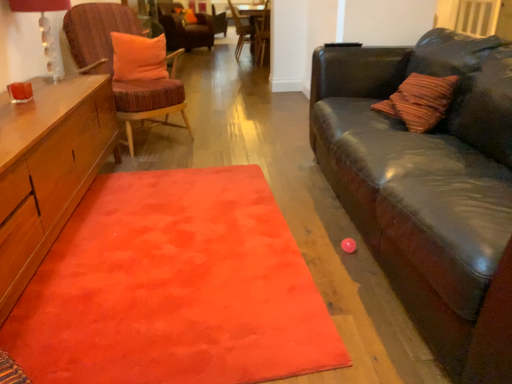
Question: Can you confirm if woven wood chair with orange cushion at left, arranged as the 4th chair when viewed from the back, is wider than matte glass lampshade at upper left?

Choices:
 (A) yes
 (B) no

Answer: (A)

Question: Are woven wood chair with orange cushion at left, arranged as the 4th chair when viewed from the back, and matte glass lampshade at upper left far apart?

Choices:
 (A) yes
 (B) no

Answer: (B)

Question: From the image's perspective, would you say woven wood chair with orange cushion at left, the first chair when ordered from front to back, is shown under matte glass lampshade at upper left?

Choices:
 (A) no
 (B) yes

Answer: (A)

Question: Is woven wood chair with orange cushion at left, the first chair when ordered from front to back, positioned before matte glass lampshade at upper left?

Choices:
 (A) no
 (B) yes

Answer: (A)

Question: Does woven wood chair with orange cushion at left, the first chair when ordered from front to back, appear on the right side of matte glass lampshade at upper left?

Choices:
 (A) no
 (B) yes

Answer: (B)

Question: Does woven wood chair with orange cushion at left, the first chair when ordered from front to back, have a larger size compared to matte glass lampshade at upper left?

Choices:
 (A) no
 (B) yes

Answer: (B)

Question: Can you confirm if orange plush pillow at upper left, which appears as the 2th pillow when viewed from the left, is thinner than velvet orange cushion at upper center, which is the 4th chair in front-to-back order?

Choices:
 (A) yes
 (B) no

Answer: (A)

Question: Does orange plush pillow at upper left, placed as the first pillow when sorted from front to back, come in front of velvet orange cushion at upper center, the 1th chair when ordered from back to front?

Choices:
 (A) yes
 (B) no

Answer: (A)

Question: From a real-world perspective, is orange plush pillow at upper left, placed as the first pillow when sorted from front to back, beneath velvet orange cushion at upper center, which is the 4th chair in front-to-back order?

Choices:
 (A) yes
 (B) no

Answer: (B)

Question: Is orange plush pillow at upper left, placed as the first pillow when sorted from front to back, beside velvet orange cushion at upper center, the 1th chair when ordered from back to front?

Choices:
 (A) no
 (B) yes

Answer: (A)

Question: Is orange plush pillow at upper left, the second pillow viewed from the back, to the left of velvet orange cushion at upper center, which is the 4th chair in front-to-back order, from the viewer's perspective?

Choices:
 (A) no
 (B) yes

Answer: (A)

Question: Is velvet orange cushion at upper center, the 1th chair when ordered from back to front, surrounded by orange plush pillow at upper left, placed as the first pillow when sorted from front to back?

Choices:
 (A) yes
 (B) no

Answer: (B)

Question: Is wooden textured chair at upper center, which is counted as the 2th chair, starting from the back, closer to the viewer compared to matte glass lampshade at upper left?

Choices:
 (A) no
 (B) yes

Answer: (A)